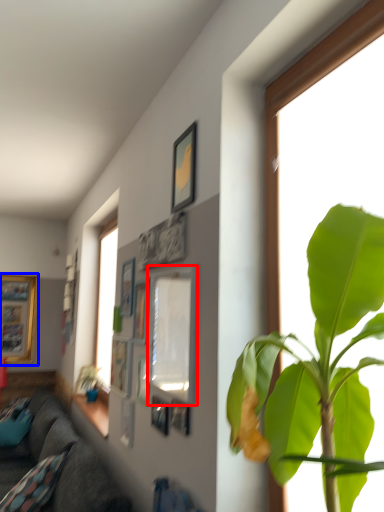
Question: Which of the following is the farthest to the observer, picture frame (highlighted by a red box) or picture frame (highlighted by a blue box)?

Choices:
 (A) picture frame
 (B) picture frame

Answer: (B)